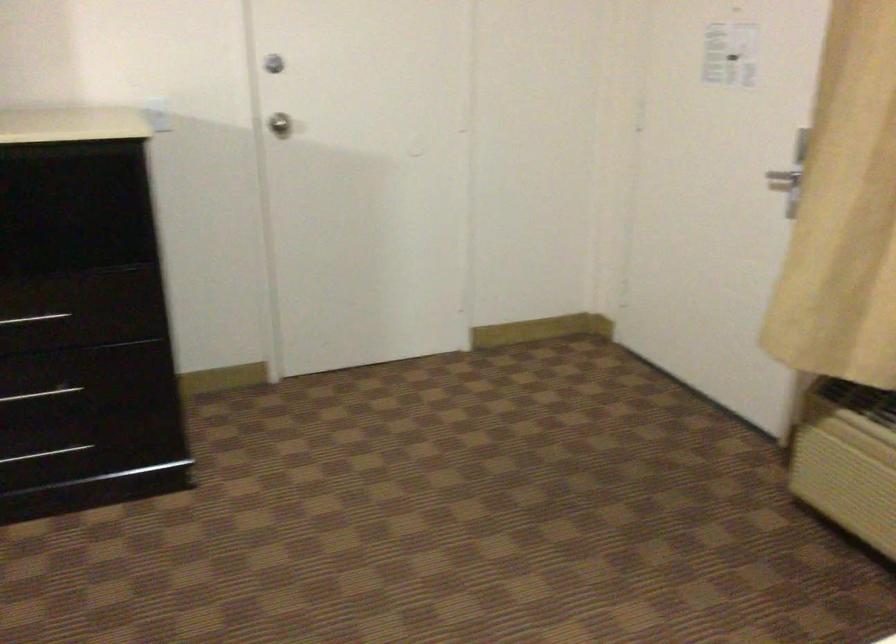
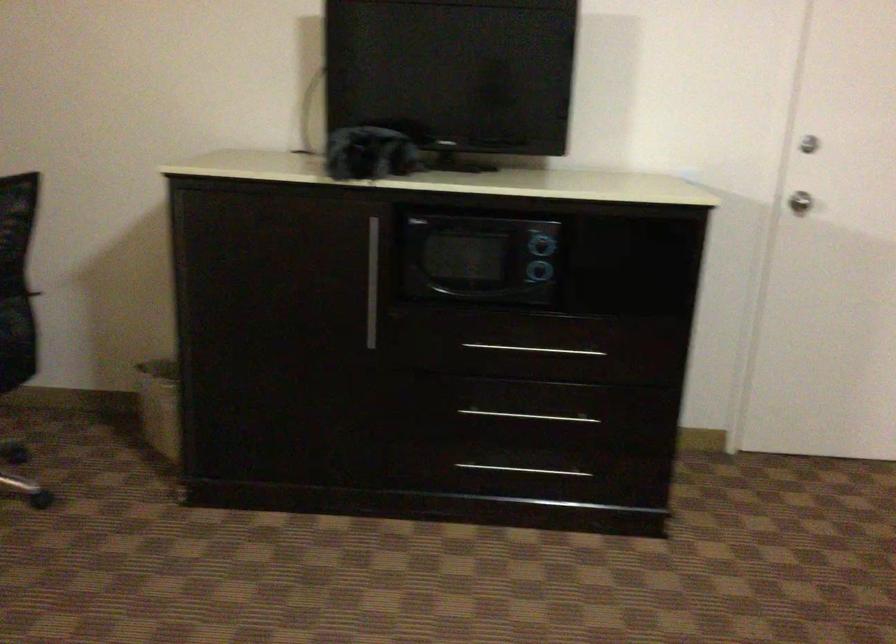
Find the pixel in the second image that matches (x=286, y=142) in the first image.

(799, 202)